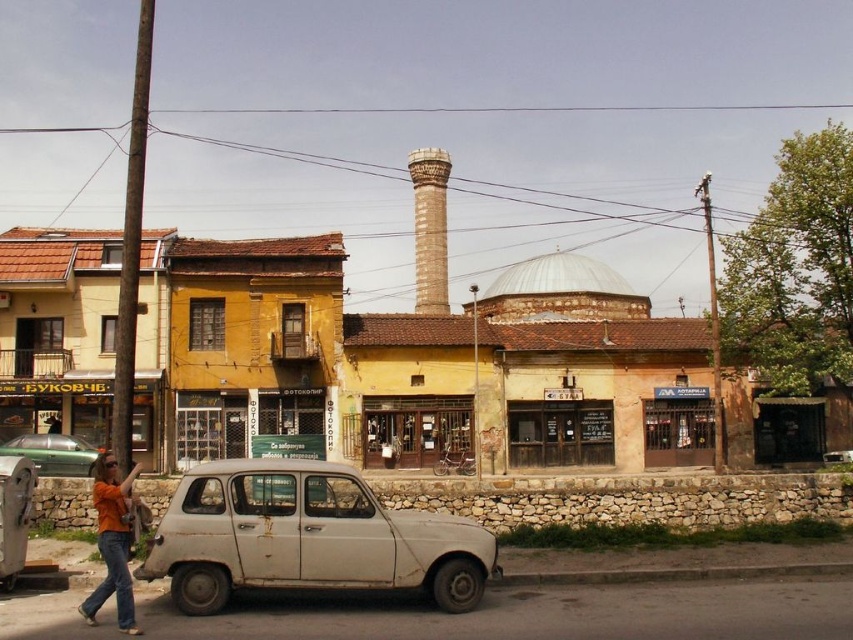
Question: Which object is farther from the camera taking this photo?

Choices:
 (A) rusty white car at center
 (B) green matte car at left
 (C) yellow painted building at center
 (D) orange cotton shirt at lower left

Answer: (C)

Question: Which point is closer to the camera?

Choices:
 (A) (619, 305)
 (B) (128, 618)
 (C) (461, 522)
 (D) (439, 154)

Answer: (B)

Question: Is yellow painted building at center smaller than rusty white car at center?

Choices:
 (A) yes
 (B) no

Answer: (B)

Question: Is yellow painted building at center wider than rusty white car at center?

Choices:
 (A) no
 (B) yes

Answer: (B)

Question: Is brown stone minaret at center smaller than white matte car at center?

Choices:
 (A) yes
 (B) no

Answer: (B)

Question: Which point is closer to the camera taking this photo?

Choices:
 (A) (199, 284)
 (B) (109, 484)

Answer: (B)